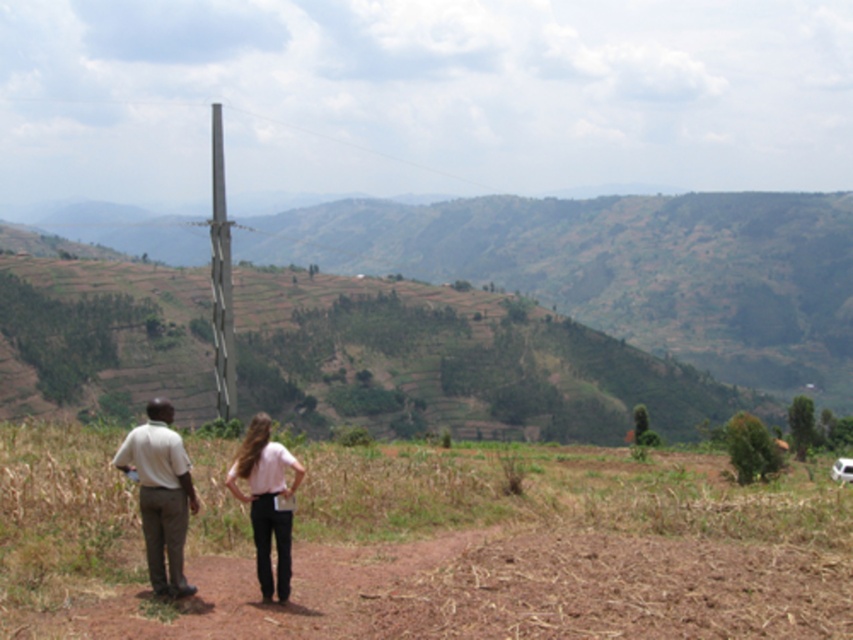
Question: Considering the real-world distances, which object is farthest from the light pink fabric shirt at center?

Choices:
 (A) pink fabric pants at center
 (B) light brown cotton shirt at lower left

Answer: (A)

Question: Which object appears farthest from the camera in this image?

Choices:
 (A) light pink fabric shirt at center
 (B) light brown cotton shirt at lower left
 (C) pink fabric pants at center

Answer: (C)

Question: Is light brown cotton shirt at lower left further to the viewer compared to pink fabric pants at center?

Choices:
 (A) no
 (B) yes

Answer: (A)

Question: Among these objects, which one is nearest to the camera?

Choices:
 (A) light pink fabric shirt at center
 (B) pink fabric pants at center

Answer: (A)

Question: Does light pink fabric shirt at center have a larger size compared to pink fabric pants at center?

Choices:
 (A) yes
 (B) no

Answer: (B)

Question: Observing the image, what is the correct spatial positioning of light pink fabric shirt at center in reference to pink fabric pants at center?

Choices:
 (A) right
 (B) left

Answer: (A)